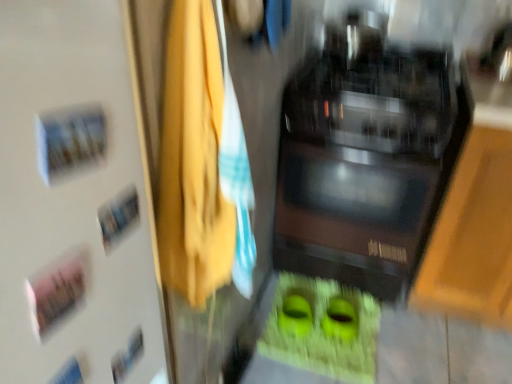
Find the location of a particular element. white matte door at upper left is located at coordinates (72, 200).

From the image's perspective, which is above, black glossy microwave at center or white matte door at upper left?

From the image's view, black glossy microwave at center is above.

Considering the positions of objects black glossy microwave at center and white matte door at upper left in the image provided, who is in front, black glossy microwave at center or white matte door at upper left?

white matte door at upper left is more forward.

In the scene shown: What's the angular difference between black glossy microwave at center and white matte door at upper left's facing directions?

90.6 degrees.

In the scene shown: Is black glossy microwave at center inside the boundaries of white matte door at upper left, or outside?

The correct answer is: outside.

Which is more to the left, black glossy microwave at center or yellow fabric at center?

yellow fabric at center is more to the left.

Can you confirm if black glossy microwave at center is shorter than yellow fabric at center?

Incorrect, the height of black glossy microwave at center does not fall short of that of yellow fabric at center.

Is black glossy microwave at center positioned far away from yellow fabric at center?

That's not correct — black glossy microwave at center is a little close to yellow fabric at center.

Does yellow fabric at center have a smaller size compared to black glossy microwave at center?

Correct, yellow fabric at center occupies less space than black glossy microwave at center.

Which of these two, yellow fabric at center or black glossy microwave at center, is wider?

black glossy microwave at center.

Which of these two, yellow fabric at center or black glossy microwave at center, stands taller?

black glossy microwave at center.

Between yellow fabric at center and black glossy microwave at center, which one appears on the left side from the viewer's perspective?

yellow fabric at center is more to the left.

From a real-world perspective, is white matte door at upper left physically located above or below black glossy microwave at center?

white matte door at upper left is situated higher than black glossy microwave at center in the real world.

From the image's perspective, which one is positioned lower, white matte door at upper left or black glossy microwave at center?

white matte door at upper left is shown below in the image.

Is white matte door at upper left bigger than black glossy microwave at center?

No, white matte door at upper left is not bigger than black glossy microwave at center.

Is white matte door at upper left aimed at black glossy microwave at center?

No, white matte door at upper left is not oriented towards black glossy microwave at center.

Between yellow fabric at center and white matte door at upper left, which one is positioned behind?

yellow fabric at center is behind.

From the image's perspective, which is above, yellow fabric at center or white matte door at upper left?

yellow fabric at center is shown above in the image.

From the picture: Looking at their sizes, would you say yellow fabric at center is wider or thinner than white matte door at upper left?

In the image, yellow fabric at center appears to be wider than white matte door at upper left.

Does point (187, 109) appear closer or farther from the camera than point (101, 288)?

Point (187, 109).

Considering the relative sizes of white matte door at upper left and yellow fabric at center in the image provided, is white matte door at upper left smaller than yellow fabric at center?

Yes.

Locate an element on the screen. The width and height of the screenshot is (512, 384). laundry on the right of white matte door at upper left is located at coordinates (202, 165).

Is white matte door at upper left inside the boundaries of yellow fabric at center, or outside?

white matte door at upper left is not enclosed by yellow fabric at center.

From a real-world perspective, is white matte door at upper left positioned above or below yellow fabric at center?

white matte door at upper left is situated higher than yellow fabric at center in the real world.

Find the location of `door above the black glossy microwave at center (from a real-world perspective)`. door above the black glossy microwave at center (from a real-world perspective) is located at coordinates (72, 200).

Where is `home appliance on the right side of yellow fabric at center`? This screenshot has width=512, height=384. home appliance on the right side of yellow fabric at center is located at coordinates (366, 155).

Looking at the image, which one is located closer to white matte door at upper left, black glossy microwave at center or yellow fabric at center?

The object closer to white matte door at upper left is yellow fabric at center.

Estimate the real-world distances between objects in this image. Which object is closer to black glossy microwave at center, white matte door at upper left or yellow fabric at center?

yellow fabric at center.

From the image, which object appears to be nearer to black glossy microwave at center, yellow fabric at center or white matte door at upper left?

Among the two, yellow fabric at center is located nearer to black glossy microwave at center.

From the image, which object appears to be farther from white matte door at upper left, yellow fabric at center or black glossy microwave at center?

Among the two, black glossy microwave at center is located further to white matte door at upper left.

Considering their positions, is black glossy microwave at center positioned further to yellow fabric at center than white matte door at upper left?

black glossy microwave at center is further to yellow fabric at center.

Estimate the real-world distances between objects in this image. Which object is further from yellow fabric at center, white matte door at upper left or black glossy microwave at center?

Among the two, black glossy microwave at center is located further to yellow fabric at center.

Identify the location of laundry positioned between white matte door at upper left and black glossy microwave at center from near to far. The width and height of the screenshot is (512, 384). (202, 165).